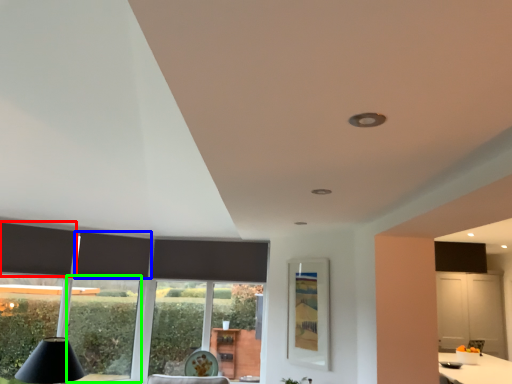
Question: Based on their relative distances, which object is nearer to curtain (highlighted by a red box)? Choose from curtain (highlighted by a blue box) and window (highlighted by a green box).

Choices:
 (A) curtain
 (B) window

Answer: (A)